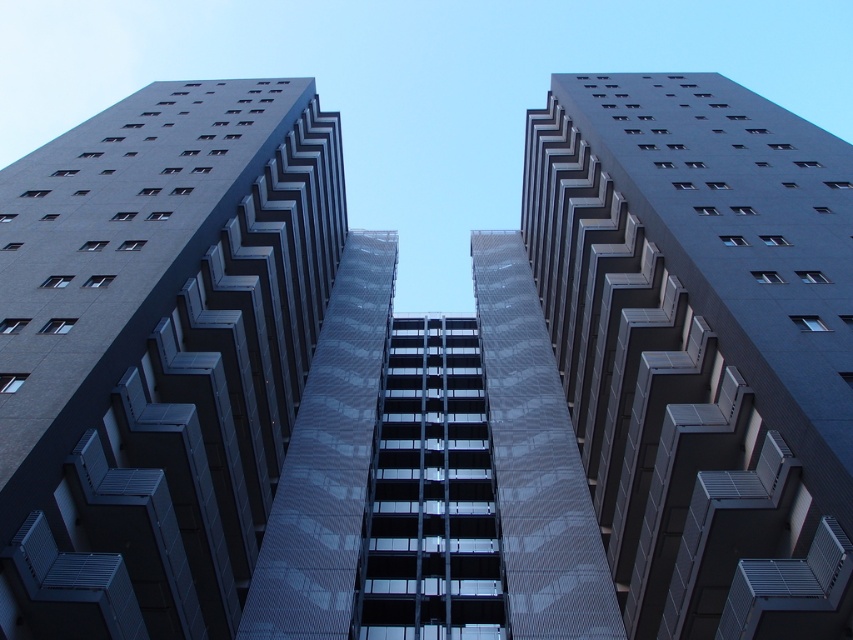
Question: Which of the following is the farthest from the observer?

Choices:
 (A) (669, 628)
 (B) (236, 554)

Answer: (B)

Question: Which object is farther from the camera taking this photo?

Choices:
 (A) smooth concrete building at center
 (B) smooth glass building at center

Answer: (A)

Question: Does smooth glass building at center have a smaller size compared to smooth concrete building at center?

Choices:
 (A) yes
 (B) no

Answer: (B)

Question: Is smooth glass building at center below smooth concrete building at center?

Choices:
 (A) yes
 (B) no

Answer: (A)

Question: From the image, what is the correct spatial relationship of smooth glass building at center in relation to smooth concrete building at center?

Choices:
 (A) left
 (B) right

Answer: (A)